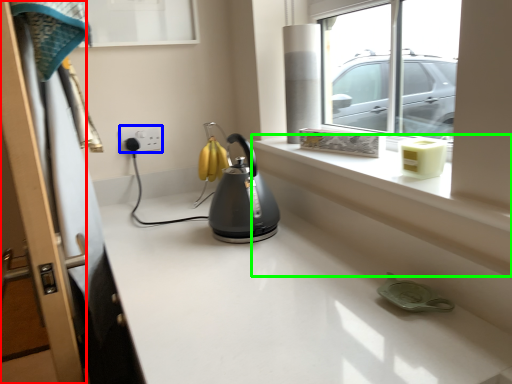
Question: Which object is positioned closest to screen door (highlighted by a red box)? Select from electric outlet (highlighted by a blue box) and ledge (highlighted by a green box).

Choices:
 (A) electric outlet
 (B) ledge

Answer: (B)